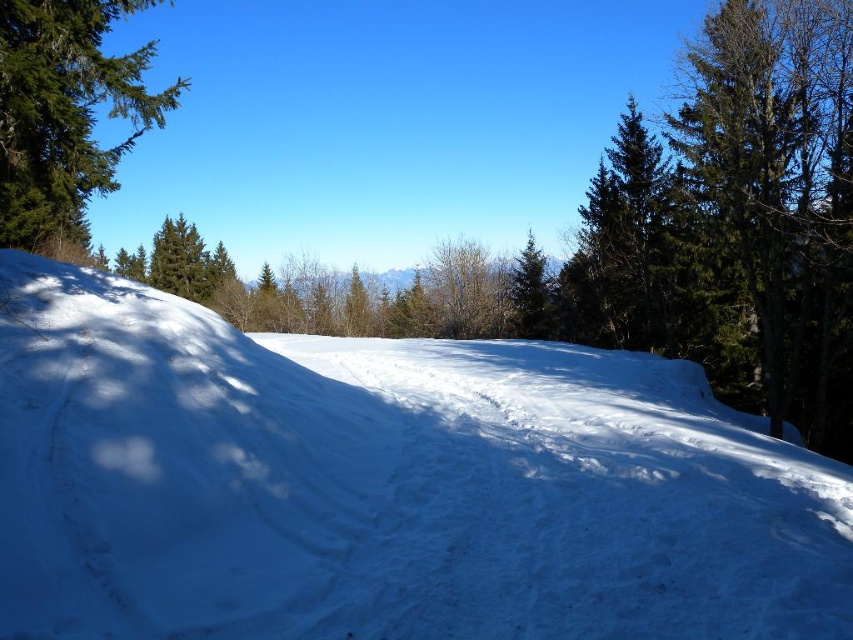
Question: Does white powdery snow at center have a larger size compared to green textured pine tree at upper left?

Choices:
 (A) yes
 (B) no

Answer: (B)

Question: Which point is farther to the camera?

Choices:
 (A) (434, 516)
 (B) (97, 74)

Answer: (B)

Question: Is white powdery snow at center bigger than green textured pine tree at upper left?

Choices:
 (A) yes
 (B) no

Answer: (B)

Question: Is white powdery snow at center behind green textured pine tree at upper left?

Choices:
 (A) no
 (B) yes

Answer: (A)